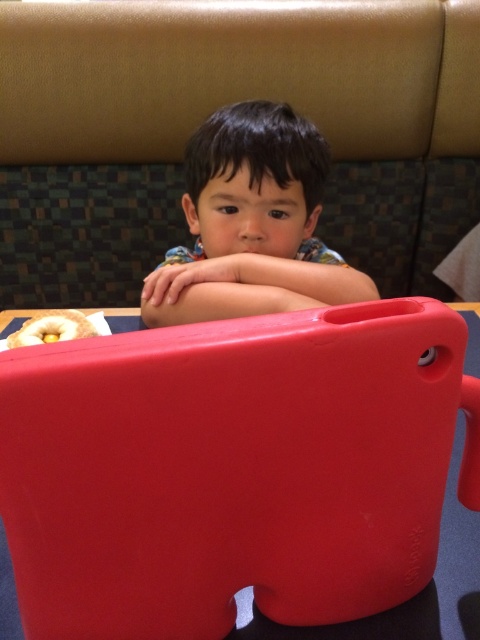
You are a parent trying to decide whether to place a small toy on the table between the matte black child at center and the glazed doughnut at lower left. Based on their heights, will the toy be visible to both the child and the doughnut?

The matte black child at center is much taller than the glazed doughnut at lower left. Since the child is taller, the toy placed between them would be visible to the child but might be obstructed from the doughnut due to its lower height.

You are a photographer setting up for a family portrait. You need to ensure that the matte black child at center and the glazed doughnut at lower left are both in frame. Given their sizes, which object should you focus on first to ensure proper framing?

The matte black child at center is larger than the glazed doughnut at lower left, so you should focus on the matte black child at center first to ensure proper framing since it takes up more space in the image.

Consider the image. You are a photographer setting up for a family portrait. You need to position a light source at point (252,224) to highlight the matte black child at center. Is the light source placement correct according to the scene?

Yes, the light source placement at point (252,224) is correct because it directly marks the location of the matte black child at center, ensuring proper illumination.